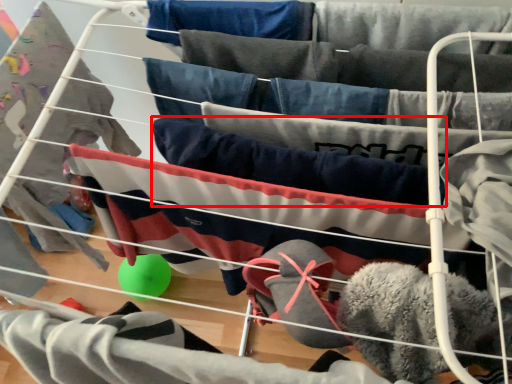
Question: Considering the relative positions of clothing (annotated by the red box) and clothing in the image provided, where is clothing (annotated by the red box) located with respect to the staircase?

Choices:
 (A) left
 (B) right

Answer: (B)